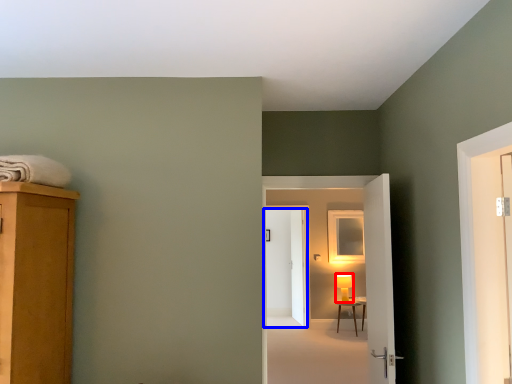
Question: Which point is closer to the camera, table lamp (highlighted by a red box) or door (highlighted by a blue box)?

Choices:
 (A) table lamp
 (B) door

Answer: (A)